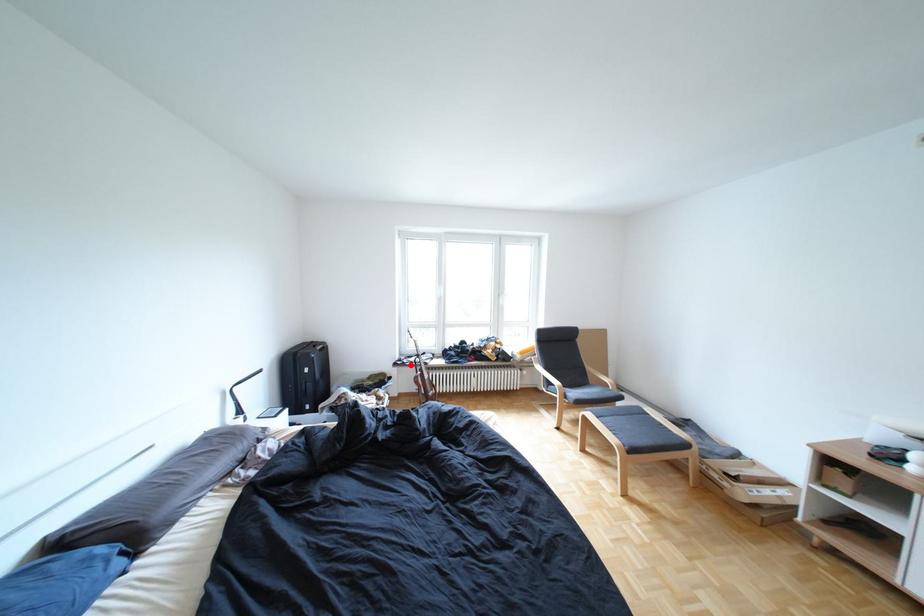
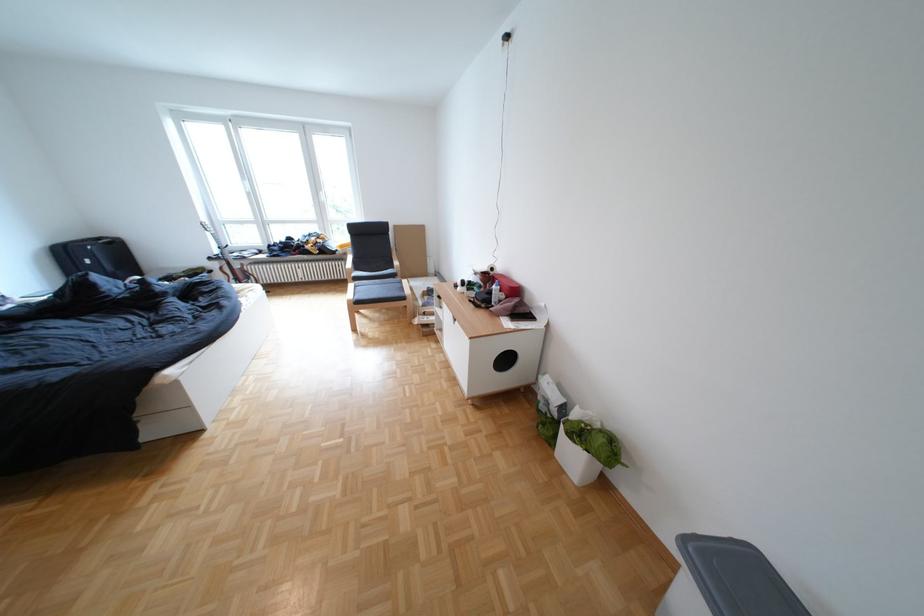
Where in the second image is the point corresponding to the highlighted location from the first image?

(225, 259)